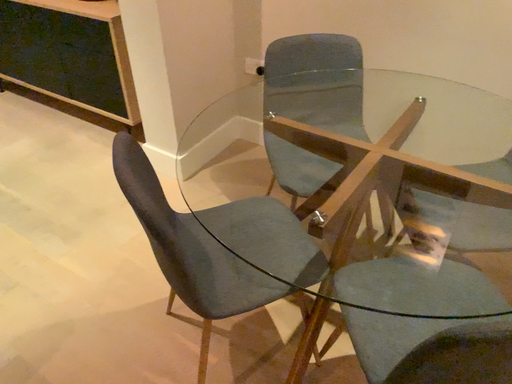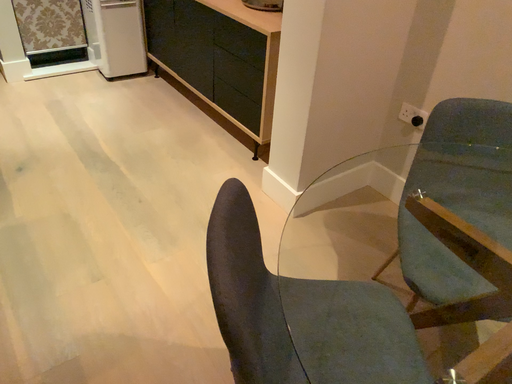
Question: Which way did the camera rotate in the video?

Choices:
 (A) rotated left
 (B) rotated right

Answer: (A)